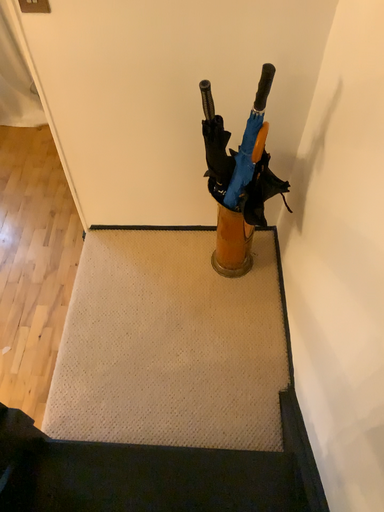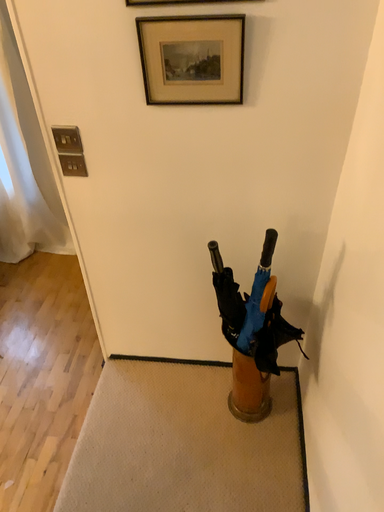
Question: How did the camera likely rotate when shooting the video?

Choices:
 (A) rotated upward
 (B) rotated downward

Answer: (A)